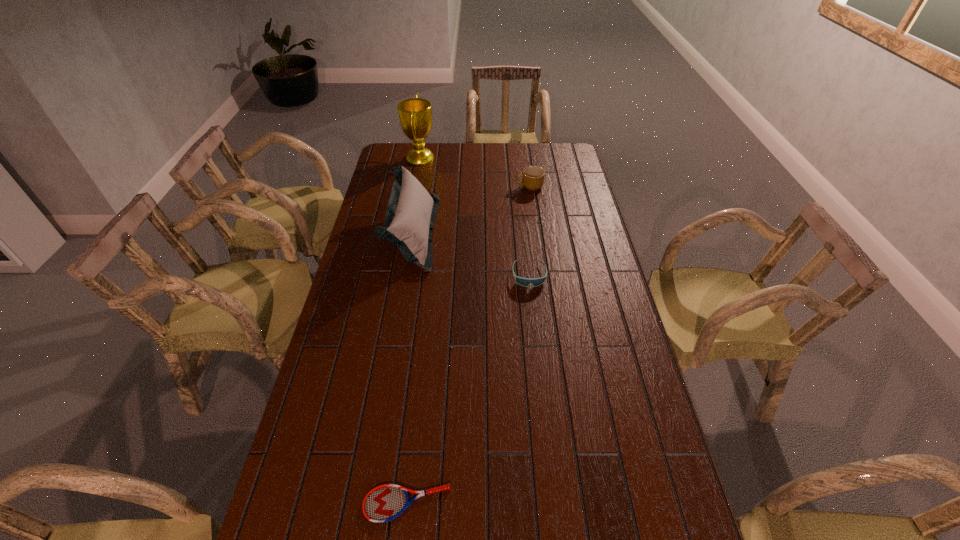
This screenshot has height=540, width=960. In the image, there is a desktop. Find the location of `free space at the left edge`. free space at the left edge is located at coordinates (360, 266).

In the image, there is a desktop. Where is `free space at the right edge`? This screenshot has height=540, width=960. free space at the right edge is located at coordinates (569, 217).

Identify the location of vacant space in between the second tallest object and the second shortest object. This screenshot has height=540, width=960. (471, 254).

This screenshot has height=540, width=960. In order to click on vacant area that lies between the fourth shortest object and the shortest object in this screenshot , I will do `click(410, 368)`.

Locate an element on the screen. This screenshot has height=540, width=960. unoccupied area between the fourth shortest object and the goggles is located at coordinates (471, 254).

I want to click on free space between the nearest object and the second tallest object, so click(x=410, y=368).

Find the location of a particular element. This screenshot has width=960, height=540. free space between the fourth shortest object and the tennis racket is located at coordinates (410, 368).

This screenshot has width=960, height=540. Identify the location of vacant space that's between the cushion and the mug. (471, 210).

Identify the location of empty location between the goggles and the tallest object. Image resolution: width=960 pixels, height=540 pixels. pos(474,217).

The image size is (960, 540). I want to click on blank region between the goggles and the shortest object, so click(468, 389).